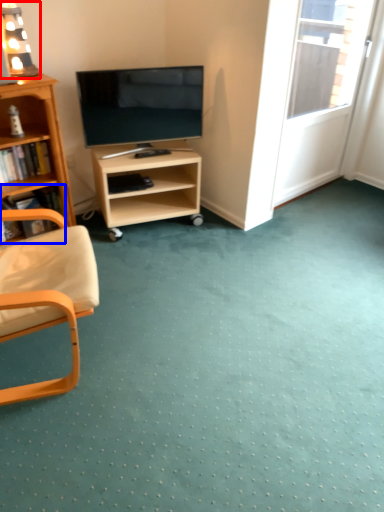
Question: Which object is closer to the camera taking this photo, lamp (highlighted by a red box) or book (highlighted by a blue box)?

Choices:
 (A) lamp
 (B) book

Answer: (A)